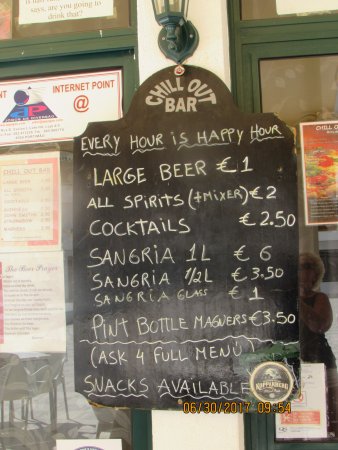
Locate an element on the screen. This screenshot has width=338, height=450. small view of green lamp is located at coordinates (175, 23).